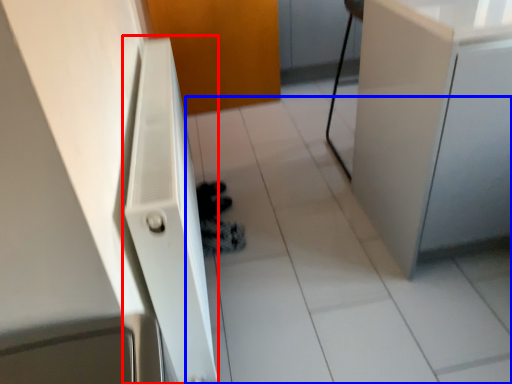
Question: Which point is further to the camera, radiator (highlighted by a red box) or tile (highlighted by a blue box)?

Choices:
 (A) radiator
 (B) tile

Answer: (B)